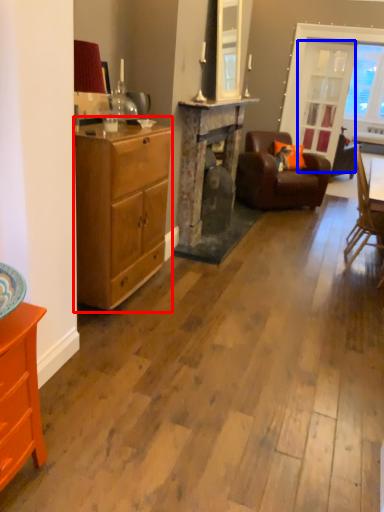
Question: Which point is further to the camera, chest of drawers (highlighted by a red box) or glass door (highlighted by a blue box)?

Choices:
 (A) chest of drawers
 (B) glass door

Answer: (B)